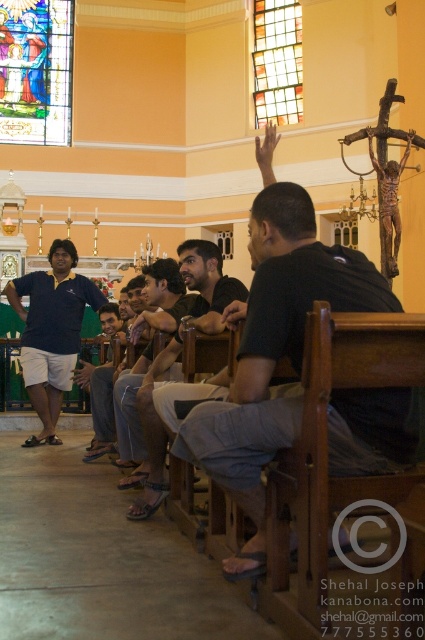
Question: Can you confirm if dark gray fabric shirt at center is positioned to the left of translucent stained glass at upper center?

Choices:
 (A) yes
 (B) no

Answer: (A)

Question: Among these objects, which one is farthest from the camera?

Choices:
 (A) stained glass window at upper left
 (B) dark blue shirt at center
 (C) translucent stained glass at upper center
 (D) dark gray fabric shirt at center

Answer: (A)

Question: Does matte blue shirt at left appear on the left side of wooden crucifix at upper right?

Choices:
 (A) yes
 (B) no

Answer: (A)

Question: Which of the following is the closest to the observer?

Choices:
 (A) (382, 179)
 (B) (342, 426)
 (C) (260, 19)

Answer: (B)

Question: Estimate the real-world distances between objects in this image. Which object is farther from the matte blue shirt at left?

Choices:
 (A) dark gray fabric shirt at center
 (B) translucent stained glass at upper center
 (C) dark blue shirt at center

Answer: (B)

Question: Can you confirm if dark blue shirt at center is positioned above wooden crucifix at upper right?

Choices:
 (A) no
 (B) yes

Answer: (A)